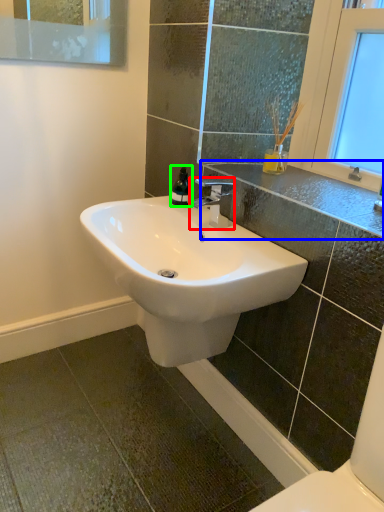
Question: Estimate the real-world distances between objects in this image. Which object is closer to tap (highlighted by a red box), counter top (highlighted by a blue box) or soap dispenser (highlighted by a green box)?

Choices:
 (A) counter top
 (B) soap dispenser

Answer: (B)